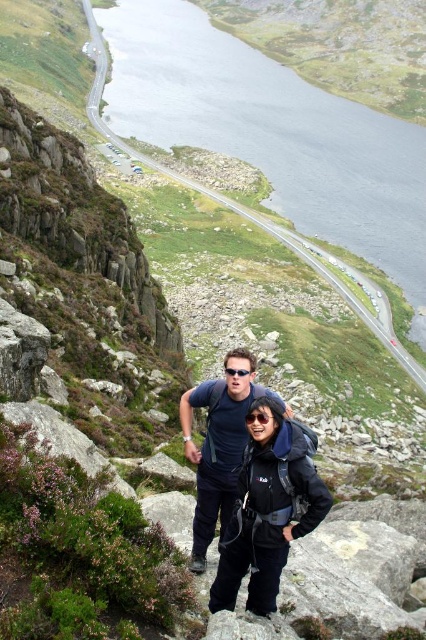
Question: Can you confirm if gray smooth water at upper center is wider than dark blue fabric shirt at center?

Choices:
 (A) no
 (B) yes

Answer: (B)

Question: Is dark blue fabric shirt at center smaller than black plastic sunglasses at center?

Choices:
 (A) no
 (B) yes

Answer: (A)

Question: Which object appears farthest from the camera in this image?

Choices:
 (A) black plastic sunglasses at center
 (B) matte black jacket at center

Answer: (A)

Question: Is the position of matte black jacket at center less distant than that of black matte goggles at center?

Choices:
 (A) yes
 (B) no

Answer: (A)

Question: Which is nearer to the dark blue fabric shirt at center?

Choices:
 (A) matte black jacket at center
 (B) black matte goggles at center
 (C) black plastic sunglasses at center
 (D) gray smooth water at upper center

Answer: (B)

Question: Which point appears farthest from the camera in this image?

Choices:
 (A) (204, 550)
 (B) (250, 412)
 (C) (256, 524)
 (D) (253, 163)

Answer: (D)